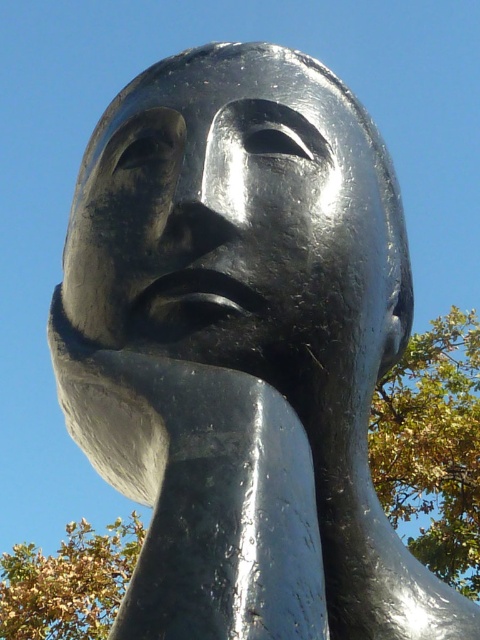
Question: Which object is closer to the camera taking this photo?

Choices:
 (A) green leafy tree at right
 (B) shiny black sculpture at center
 (C) green leafy tree at lower left

Answer: (B)

Question: Does shiny black sculpture at center have a lesser width compared to green leafy tree at lower left?

Choices:
 (A) no
 (B) yes

Answer: (B)

Question: Is green leafy tree at right positioned behind green leafy tree at lower left?

Choices:
 (A) yes
 (B) no

Answer: (B)

Question: Which object appears farthest from the camera in this image?

Choices:
 (A) green leafy tree at right
 (B) green leafy tree at lower left

Answer: (B)

Question: Which object appears closest to the camera in this image?

Choices:
 (A) shiny black sculpture at center
 (B) green leafy tree at lower left

Answer: (A)

Question: Can you confirm if shiny black sculpture at center is positioned to the left of green leafy tree at lower left?

Choices:
 (A) yes
 (B) no

Answer: (B)